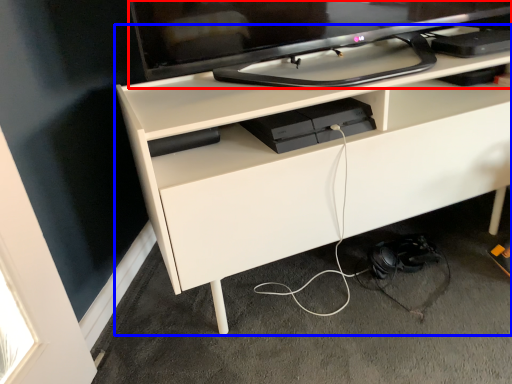
Question: Which object is closer to the camera taking this photo, television (highlighted by a red box) or desk (highlighted by a blue box)?

Choices:
 (A) television
 (B) desk

Answer: (A)